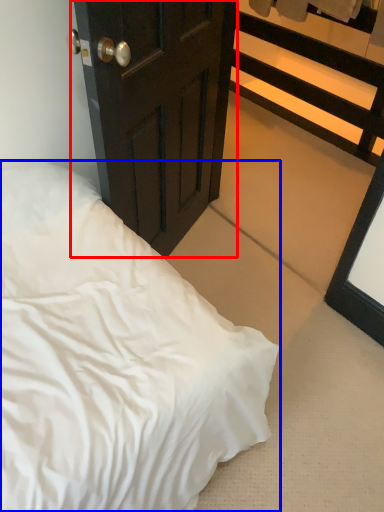
Question: Which of the following is the closest to the observer, door (highlighted by a red box) or bed (highlighted by a blue box)?

Choices:
 (A) door
 (B) bed

Answer: (A)